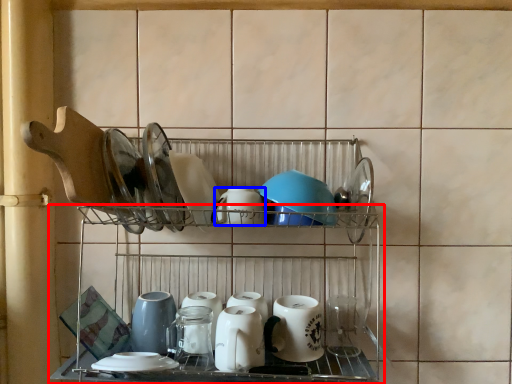
Question: Which object is further to the camera taking this photo, shelf (highlighted by a red box) or tableware (highlighted by a blue box)?

Choices:
 (A) shelf
 (B) tableware

Answer: (B)